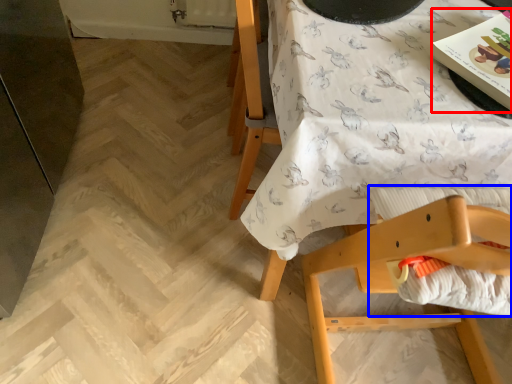
Question: Which object is further to the camera taking this photo, magazine (highlighted by a red box) or sheet (highlighted by a blue box)?

Choices:
 (A) magazine
 (B) sheet

Answer: (A)